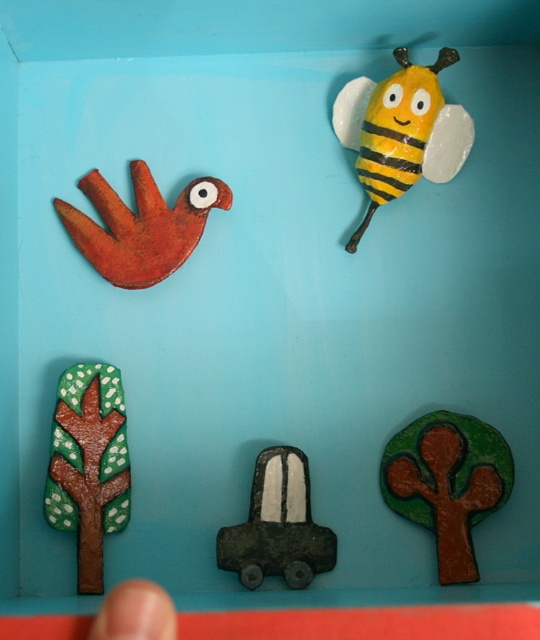
Question: Is yellow striped bee at upper right positioned in front of matte orange bird at upper left?

Choices:
 (A) no
 (B) yes

Answer: (B)

Question: Can you confirm if yellow striped bee at upper right is smaller than matte black car at center?

Choices:
 (A) yes
 (B) no

Answer: (B)

Question: Which is nearer to the brown matte tree at lower left?

Choices:
 (A) yellow striped bee at upper right
 (B) green matte tree at lower right
 (C) matte orange bird at upper left
 (D) matte black car at center

Answer: (D)

Question: Estimate the real-world distances between objects in this image. Which object is farther from the brown matte tree at lower left?

Choices:
 (A) matte orange bird at upper left
 (B) yellow striped bee at upper right
 (C) matte black car at center

Answer: (B)

Question: Is green matte tree at lower right further to the viewer compared to yellow striped bee at upper right?

Choices:
 (A) no
 (B) yes

Answer: (A)

Question: Which point is closer to the camera?

Choices:
 (A) (86, 540)
 (B) (130, 164)

Answer: (A)